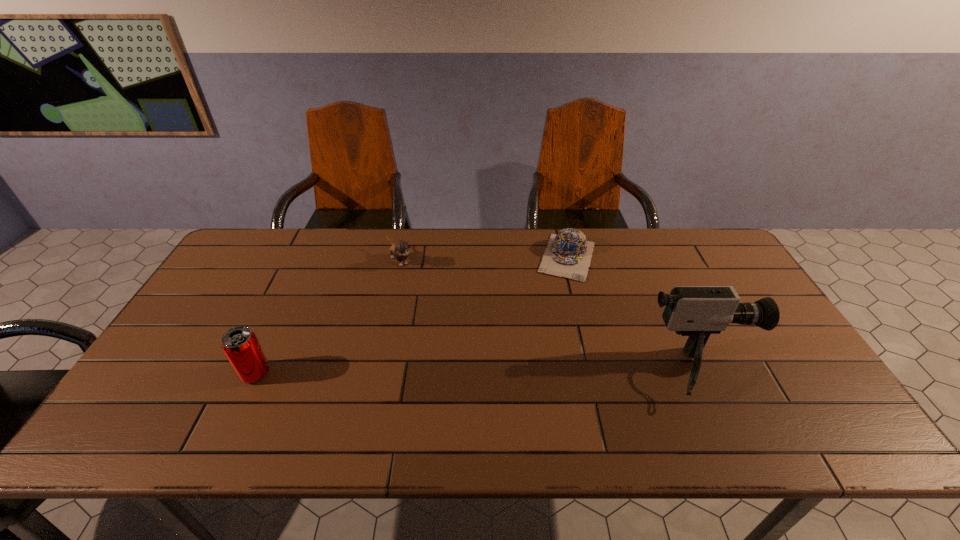
Image resolution: width=960 pixels, height=540 pixels. I want to click on vacant area between the soda can and the third object from left to right, so click(412, 315).

At what (x,y) coordinates should I click in order to perform the action: click on unoccupied position between the kitten and the tallest object. Please return your answer as a coordinate pair (x, y). The width and height of the screenshot is (960, 540). Looking at the image, I should click on (551, 317).

Locate an element on the screen. free spot between the soda can and the second shortest object is located at coordinates (328, 317).

Identify the location of vacant point located between the third object from left to right and the rightmost object. The image size is (960, 540). (635, 315).

This screenshot has height=540, width=960. Find the location of `vacant space in between the camcorder and the third tallest object`. vacant space in between the camcorder and the third tallest object is located at coordinates (551, 317).

Find the location of a particular element. The height and width of the screenshot is (540, 960). vacant region between the shortest object and the soda can is located at coordinates (412, 315).

Identify the location of free space between the kitten and the leftmost object. Image resolution: width=960 pixels, height=540 pixels. (328, 317).

Where is `free space between the soda can and the second shortest object`? The width and height of the screenshot is (960, 540). free space between the soda can and the second shortest object is located at coordinates (328, 317).

This screenshot has height=540, width=960. What are the coordinates of `free spot between the third object from left to right and the soda can` in the screenshot? It's located at (412, 315).

Identify the location of blank region between the second tallest object and the second object from right to left. The width and height of the screenshot is (960, 540). (412, 315).